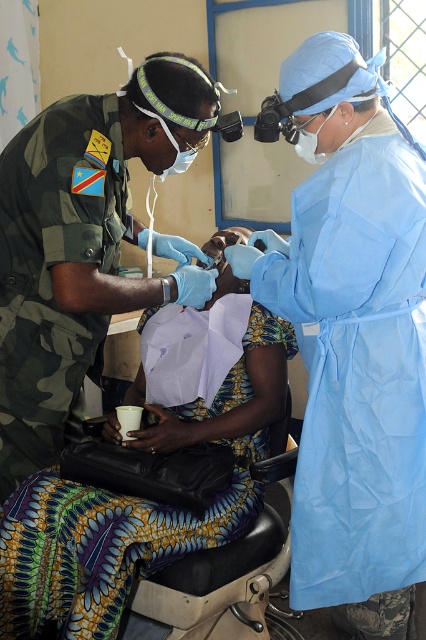
Question: Which object is farther from the camera taking this photo?

Choices:
 (A) camouflage fabric uniform at left
 (B) blue smooth gown at center

Answer: (A)

Question: Estimate the real-world distances between objects in this image. Which object is farther from the camouflage fabric uniform at left?

Choices:
 (A) black leather chair at lower center
 (B) printed fabric skirt at center
 (C) blue smooth gown at center

Answer: (A)

Question: Does blue smooth gown at center appear under black leather chair at lower center?

Choices:
 (A) no
 (B) yes

Answer: (A)

Question: Which object is positioned farthest from the camouflage fabric uniform at left?

Choices:
 (A) blue smooth gown at center
 (B) black leather chair at lower center
 (C) printed fabric skirt at center

Answer: (B)

Question: Does printed fabric skirt at center appear over black leather chair at lower center?

Choices:
 (A) yes
 (B) no

Answer: (A)

Question: Where is blue smooth gown at center located in relation to printed fabric skirt at center in the image?

Choices:
 (A) below
 (B) above

Answer: (B)